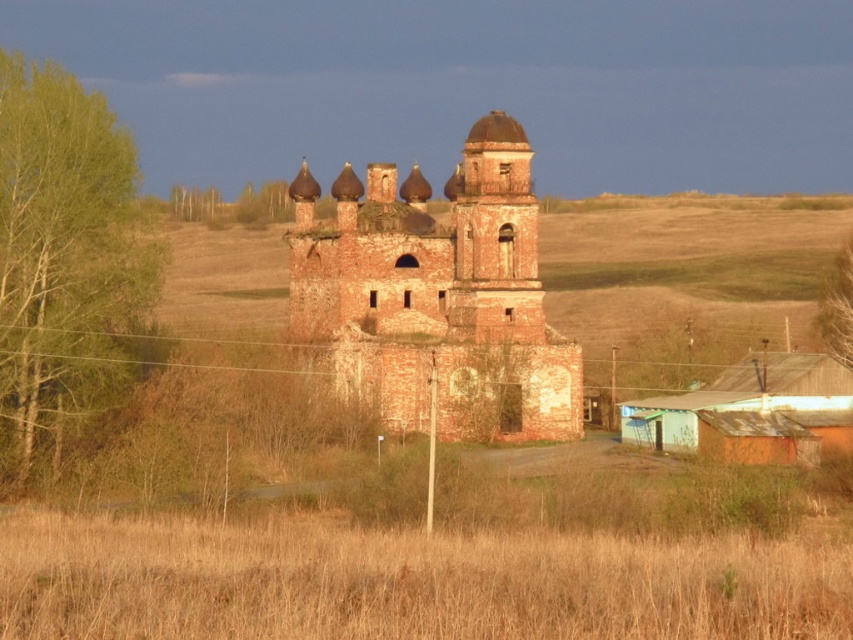
Question: Is brown corrugated metal hut at lower right closer to the viewer compared to green leafy tree at right?

Choices:
 (A) no
 (B) yes

Answer: (B)

Question: Is green leafy tree at left smaller than brown corrugated metal hut at lower right?

Choices:
 (A) no
 (B) yes

Answer: (A)

Question: Can you confirm if red brick church at center is bigger than green leafy tree at right?

Choices:
 (A) yes
 (B) no

Answer: (A)

Question: Among these points, which one is farthest from the camera?

Choices:
 (A) (84, 314)
 (B) (839, 356)
 (C) (663, 429)

Answer: (B)

Question: Which object appears closest to the camera in this image?

Choices:
 (A) brown corrugated metal hut at lower right
 (B) green leafy tree at right
 (C) red brick church at center

Answer: (A)

Question: Which point is closer to the camera?

Choices:
 (A) (38, 129)
 (B) (708, 433)
 (C) (520, 339)
 (D) (834, 324)

Answer: (A)